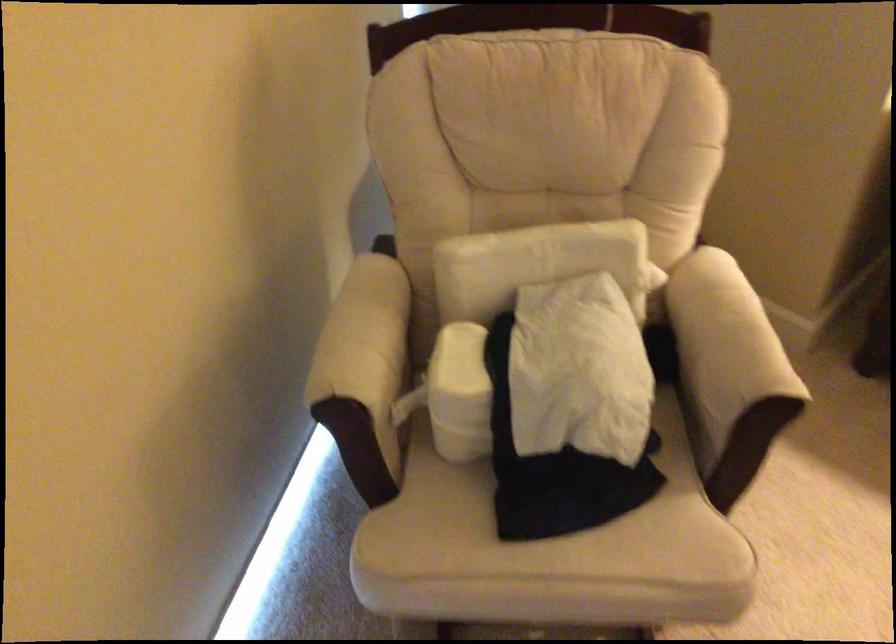
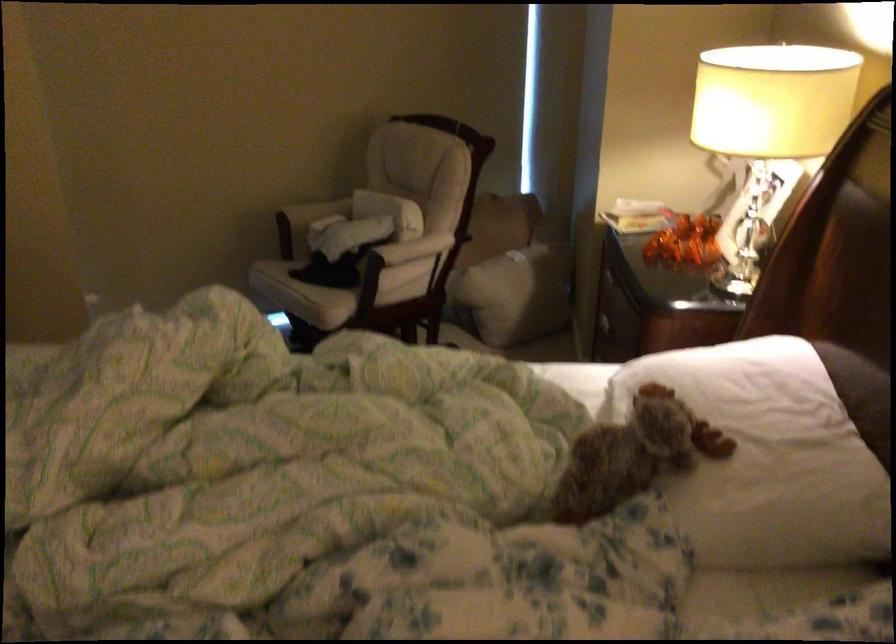
Where in the second image is the point corresponding to (782,344) from the first image?

(415, 250)